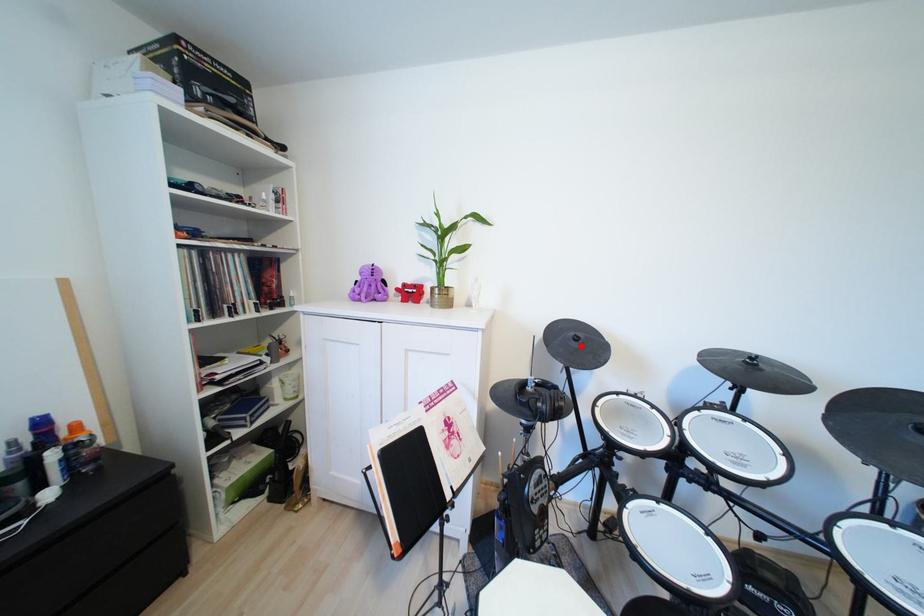
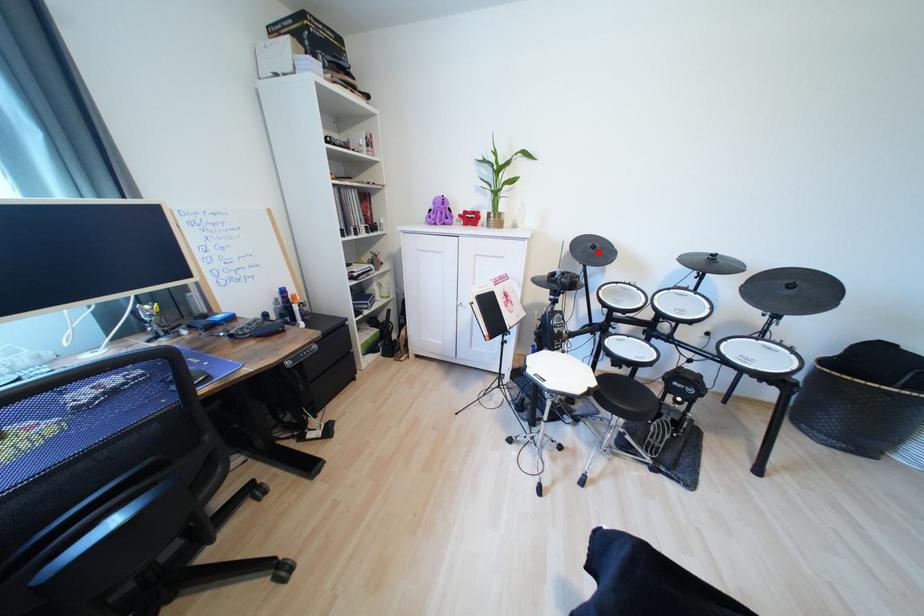
I am providing you with two images of the same scene from different viewpoints. A red point is marked on the first image and another point is marked on the second image. Is the marked point in image1 the same physical position as the marked point in image2?

Yes